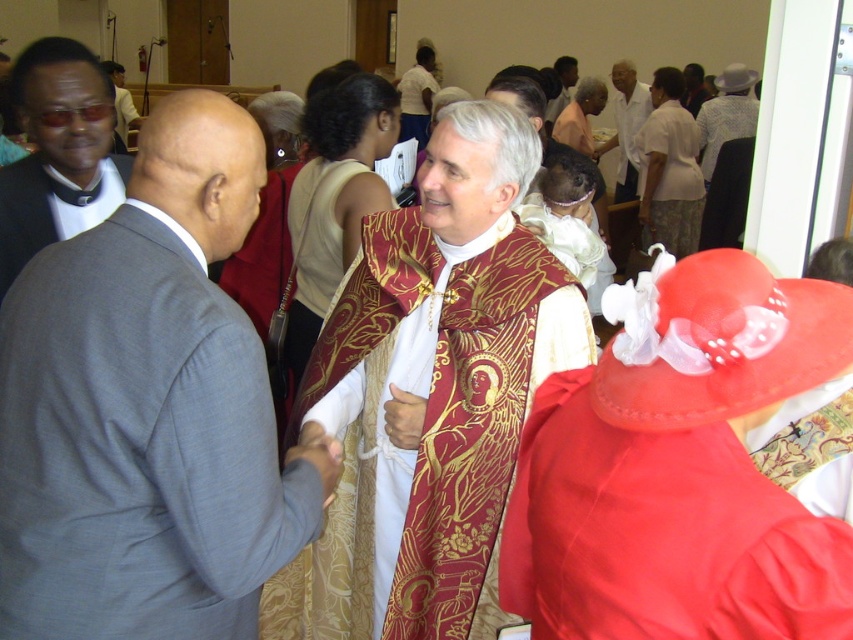
Question: Which object is the closest to the gold embroidered vestment at center?

Choices:
 (A) gold embroidered robe at center
 (B) white silk shirt at upper right
 (C) matte gold robe at center
 (D) gray suit at left

Answer: (D)

Question: Can you confirm if gold embroidered vestment at center is bigger than gold embroidered robe at center?

Choices:
 (A) yes
 (B) no

Answer: (A)

Question: Based on their relative distances, which object is nearer to the matte gold vestment at center?

Choices:
 (A) gold embroidered robe at center
 (B) matte black suit at left

Answer: (A)

Question: Is gray suit at left bigger than matte gold robe at center?

Choices:
 (A) no
 (B) yes

Answer: (B)

Question: Estimate the real-world distances between objects in this image. Which object is closer to the gray suit at left?

Choices:
 (A) matte gold vestment at center
 (B) gold embroidered vestment at center
 (C) matte black suit at left
 (D) white silk shirt at upper right

Answer: (B)

Question: Is gray suit at left above gold embroidered vestment at center?

Choices:
 (A) yes
 (B) no

Answer: (A)